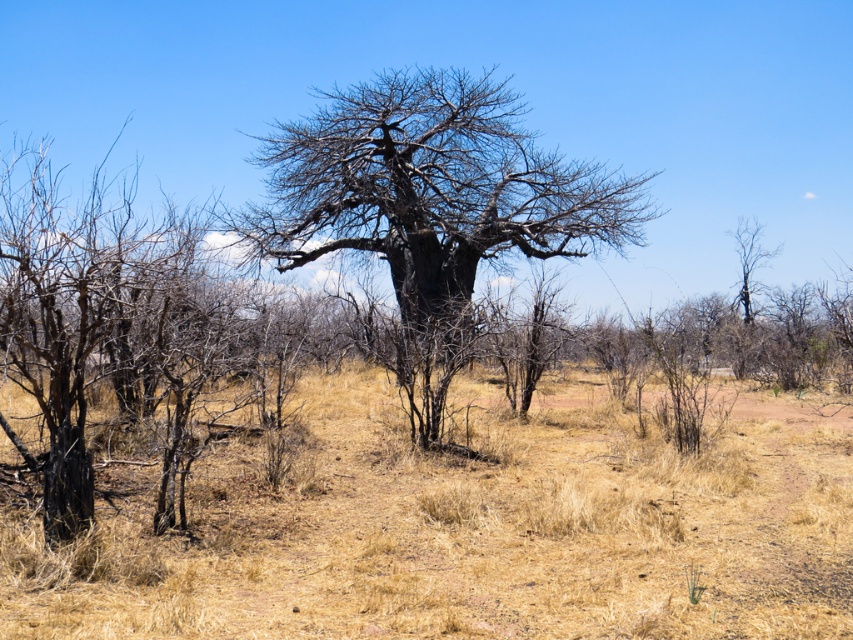
Question: Is dry grass at center smaller than bare wood tree at center?

Choices:
 (A) no
 (B) yes

Answer: (B)

Question: Which object is farther from the camera taking this photo?

Choices:
 (A) bare wood tree at center
 (B) dry grass at center

Answer: (A)

Question: Is dry grass at center below bare wood tree at center?

Choices:
 (A) yes
 (B) no

Answer: (A)

Question: Is dry grass at center to the right of bare wood tree at center from the viewer's perspective?

Choices:
 (A) yes
 (B) no

Answer: (A)